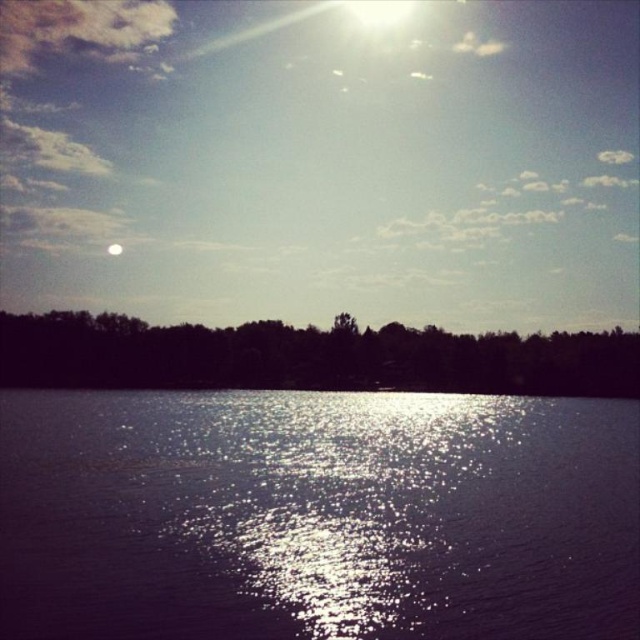
Image resolution: width=640 pixels, height=640 pixels. What do you see at coordinates (308, 356) in the screenshot? I see `silhouette leafy trees at center` at bounding box center [308, 356].

Can you confirm if silhouette leafy trees at center is smaller than white glossy moon at upper center?

No.

Where is `silhouette leafy trees at center`? silhouette leafy trees at center is located at coordinates (308, 356).

Locate an element on the screen. Image resolution: width=640 pixels, height=640 pixels. silhouette leafy trees at center is located at coordinates (308, 356).

In the scene shown: Does glistening reflective water at center appear over white glossy moon at upper center?

No, glistening reflective water at center is not above white glossy moon at upper center.

Does point (170, 625) lie behind point (115, 244)?

That is False.

Find the location of a particular element. The height and width of the screenshot is (640, 640). glistening reflective water at center is located at coordinates (316, 516).

Image resolution: width=640 pixels, height=640 pixels. Identify the location of glistening reflective water at center. (316, 516).

Does glistening reflective water at center have a larger size compared to silhouette leafy trees at center?

No.

Find the location of `glistening reflective water at center`. glistening reflective water at center is located at coordinates (316, 516).